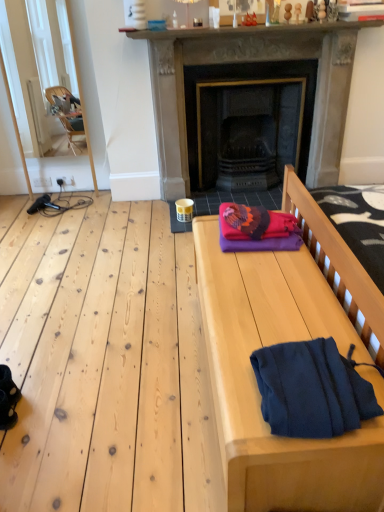
Question: Can you confirm if knitted woolen blanket at center is smaller than smooth wooden bench at right?

Choices:
 (A) no
 (B) yes

Answer: (B)

Question: Could you tell me if knitted woolen blanket at center is turned towards smooth wooden bench at right?

Choices:
 (A) yes
 (B) no

Answer: (B)

Question: From the image's perspective, is knitted woolen blanket at center on top of smooth wooden bench at right?

Choices:
 (A) no
 (B) yes

Answer: (B)

Question: Does knitted woolen blanket at center appear on the left side of smooth wooden bench at right?

Choices:
 (A) yes
 (B) no

Answer: (B)

Question: Does knitted woolen blanket at center lie in front of smooth wooden bench at right?

Choices:
 (A) yes
 (B) no

Answer: (B)

Question: Does knitted woolen blanket at center have a greater width compared to smooth wooden bench at right?

Choices:
 (A) no
 (B) yes

Answer: (A)

Question: Is dark blue fleece at lower right taller than smooth stone mantle at upper center?

Choices:
 (A) yes
 (B) no

Answer: (A)

Question: Can you confirm if dark blue fleece at lower right is thinner than smooth stone mantle at upper center?

Choices:
 (A) no
 (B) yes

Answer: (A)

Question: Is dark blue fleece at lower right bigger than smooth stone mantle at upper center?

Choices:
 (A) yes
 (B) no

Answer: (B)

Question: From the image's perspective, is dark blue fleece at lower right over smooth stone mantle at upper center?

Choices:
 (A) yes
 (B) no

Answer: (B)

Question: Considering the relative sizes of dark blue fleece at lower right and smooth stone mantle at upper center in the image provided, is dark blue fleece at lower right shorter than smooth stone mantle at upper center?

Choices:
 (A) yes
 (B) no

Answer: (B)

Question: Is dark blue fleece at lower right outside smooth stone mantle at upper center?

Choices:
 (A) yes
 (B) no

Answer: (A)

Question: Considering the relative positions of smooth wooden bench at right and dark gray stone fireplace at center in the image provided, is smooth wooden bench at right to the left of dark gray stone fireplace at center from the viewer's perspective?

Choices:
 (A) yes
 (B) no

Answer: (A)